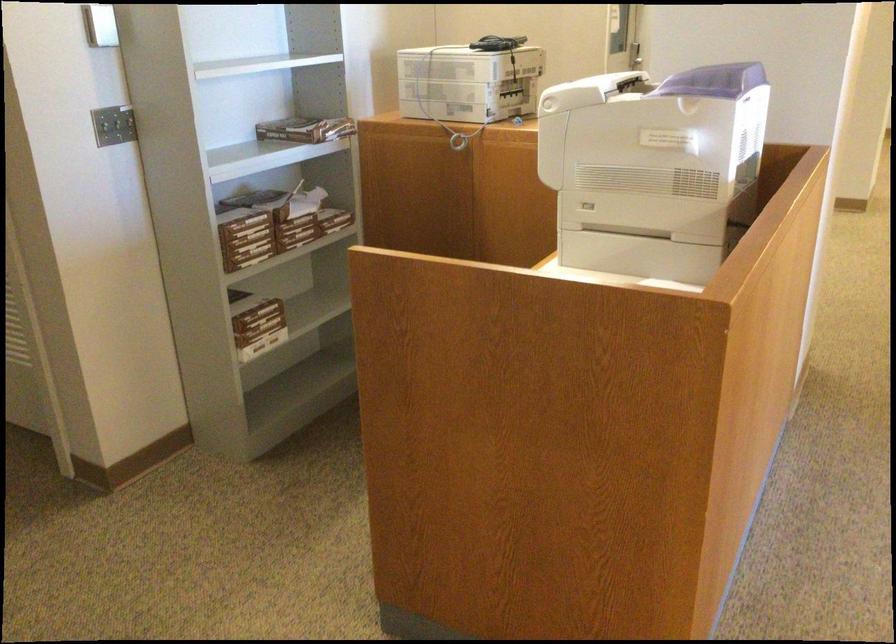
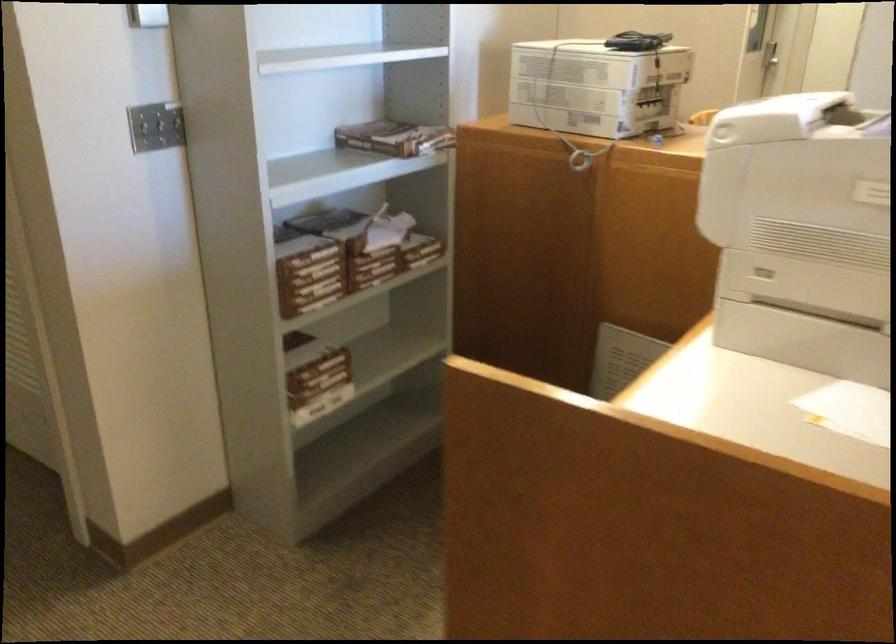
Question: The images are taken continuously from a first-person perspective. In which direction is your viewpoint rotating?

Choices:
 (A) Left
 (B) Right
 (C) Up
 (D) Down

Answer: (A)